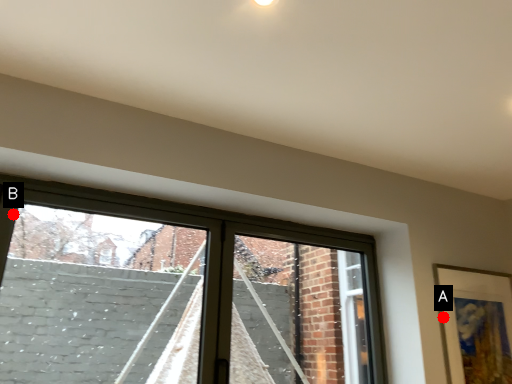
Question: Two points are circled on the image, labeled by A and B beside each circle. Which of the following is the closest to the observer?

Choices:
 (A) A is closer
 (B) B is closer

Answer: (B)